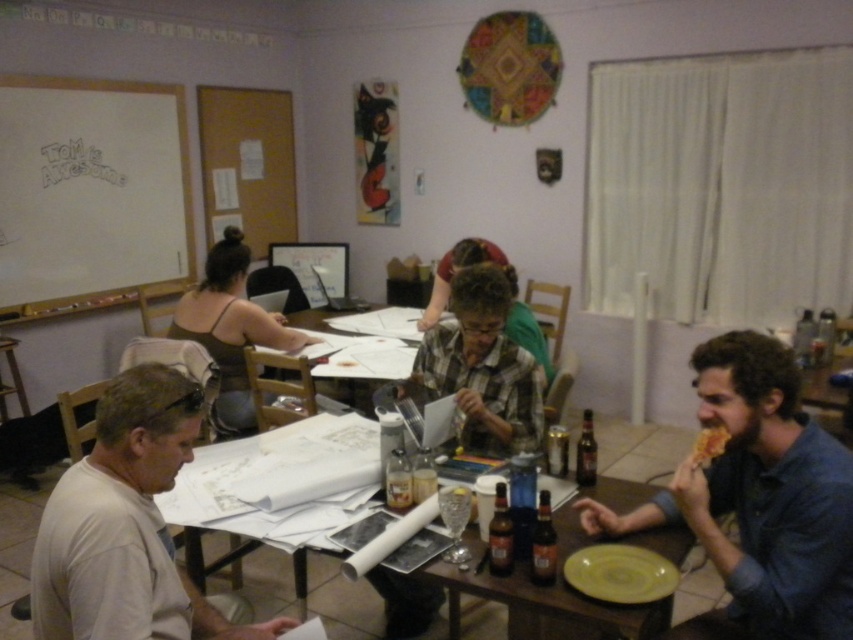
In the scene shown: You are standing at the entrance of the room and want to reach the white paper at center. Which direction should you move to get closer to it?

Move towards the center of the room to reach the white paper at center, as it is located at point (373, 348).

You are organizing a photo album and want to include a picture of the checkered fabric shirt at center and the brown fabric shirt at upper left. If you want to place them side by side without overlapping, which shirt should be placed first to ensure they both fit?

The checkered fabric shirt at center should be placed first since it occupies less space than the brown fabric shirt at upper left, allowing both to fit side by side without overlapping.